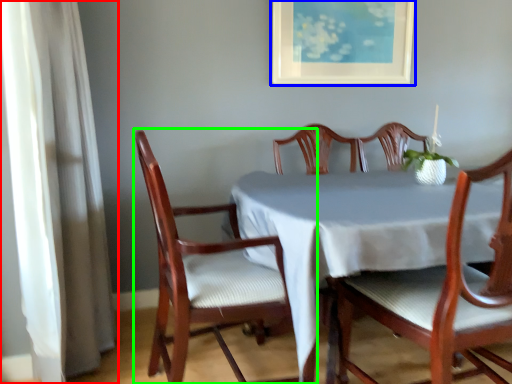
Question: Which object is the farthest from curtain (highlighted by a red box)? Choose among these: picture frame (highlighted by a blue box) or chair (highlighted by a green box).

Choices:
 (A) picture frame
 (B) chair

Answer: (A)